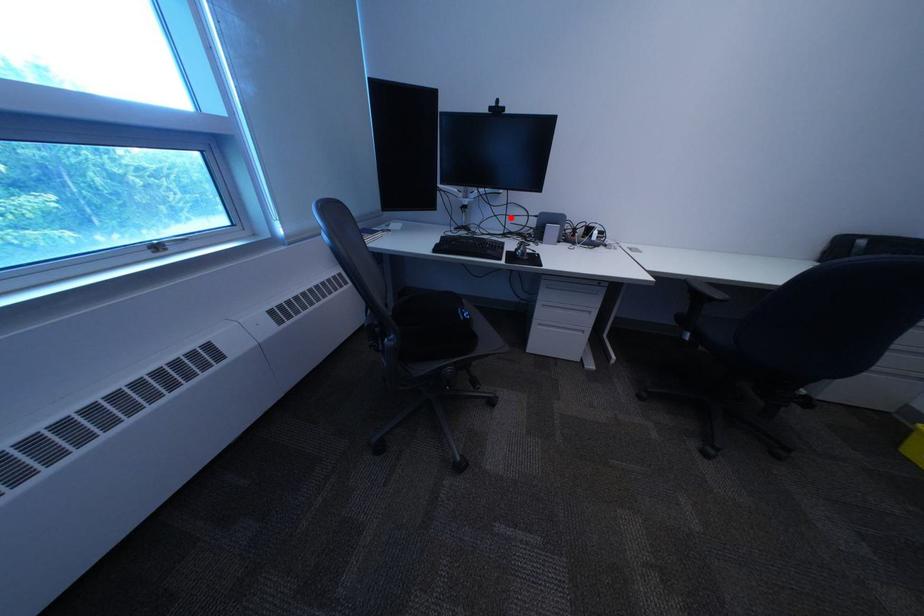
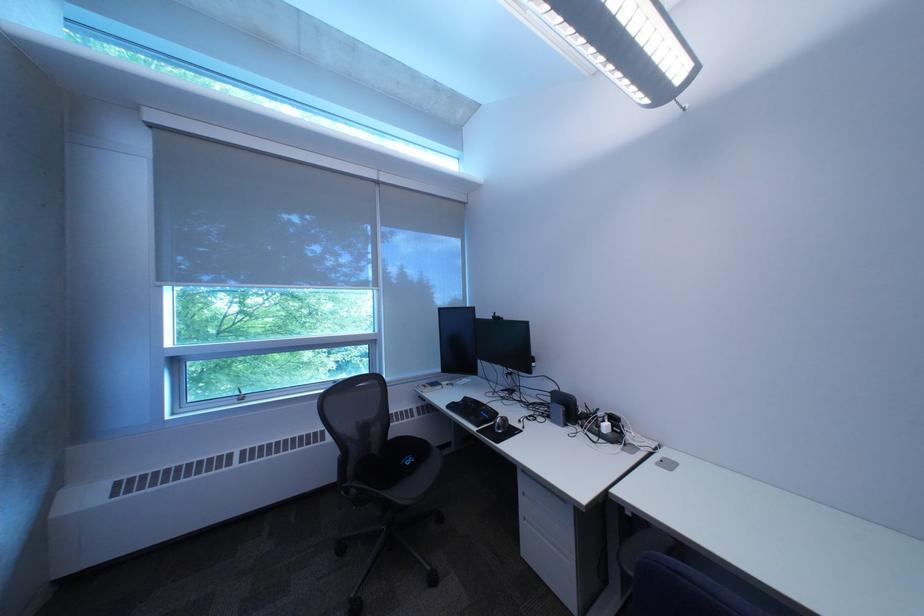
Question: I am providing you with two images of the same scene from different viewpoints. Image1 has a red point marked. In image2, the corresponding 3D location appears at what relative position? Reply with the corresponding letter.

Choices:
 (A) Closer
 (B) Farther

Answer: (B)